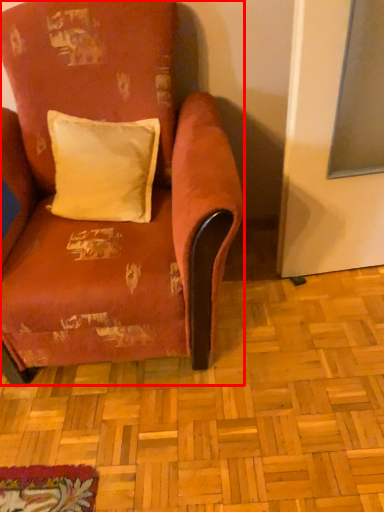
Question: In this image, where is chair (annotated by the red box) located relative to pillow?

Choices:
 (A) left
 (B) right

Answer: (A)